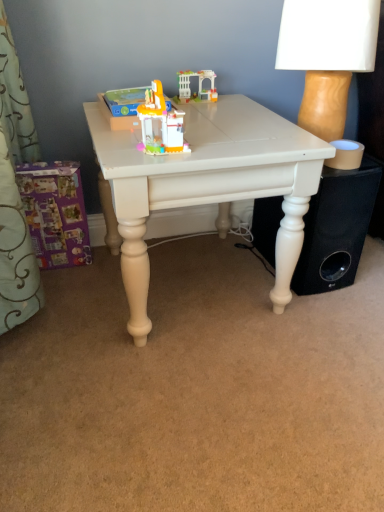
Question: Is black matte speaker at lower right closer to the viewer compared to purple cardboard box at lower left, the 1th toy positioned from the bottom?

Choices:
 (A) yes
 (B) no

Answer: (A)

Question: Would you consider black matte speaker at lower right to be distant from purple cardboard box at lower left, acting as the 2th toy starting from the back?

Choices:
 (A) yes
 (B) no

Answer: (B)

Question: Can you confirm if black matte speaker at lower right is positioned to the right of purple cardboard box at lower left, arranged as the first toy when viewed from the left?

Choices:
 (A) yes
 (B) no

Answer: (A)

Question: Considering the relative sizes of black matte speaker at lower right and purple cardboard box at lower left, acting as the 2th toy starting from the back, in the image provided, is black matte speaker at lower right thinner than purple cardboard box at lower left, acting as the 2th toy starting from the back,?

Choices:
 (A) no
 (B) yes

Answer: (A)

Question: Are black matte speaker at lower right and purple cardboard box at lower left, acting as the 2th toy starting from the back, making contact?

Choices:
 (A) no
 (B) yes

Answer: (A)

Question: Considering the relative sizes of black matte speaker at lower right and purple cardboard box at lower left, the 1th toy positioned from the bottom, in the image provided, is black matte speaker at lower right smaller than purple cardboard box at lower left, the 1th toy positioned from the bottom,?

Choices:
 (A) yes
 (B) no

Answer: (B)

Question: Considering the relative positions of white painted wood table at center and white plastic arch at center, positioned as the 1th toy in right-to-left order, in the image provided, is white painted wood table at center to the right of white plastic arch at center, positioned as the 1th toy in right-to-left order, from the viewer's perspective?

Choices:
 (A) no
 (B) yes

Answer: (A)

Question: Is white painted wood table at center next to white plastic arch at center, positioned as the 4th toy in front-to-back order?

Choices:
 (A) yes
 (B) no

Answer: (B)

Question: Considering the relative sizes of white painted wood table at center and white plastic arch at center, acting as the first toy starting from the top, in the image provided, is white painted wood table at center taller than white plastic arch at center, acting as the first toy starting from the top,?

Choices:
 (A) no
 (B) yes

Answer: (B)

Question: Is white painted wood table at center positioned far away from white plastic arch at center, the fourth toy in the bottom-to-top sequence?

Choices:
 (A) no
 (B) yes

Answer: (A)

Question: From a real-world perspective, is white painted wood table at center under white plastic arch at center, the fourth toy in the bottom-to-top sequence?

Choices:
 (A) yes
 (B) no

Answer: (A)

Question: Considering the relative positions of white painted wood table at center and white plastic arch at center, positioned as the 1th toy in right-to-left order, in the image provided, is white painted wood table at center in front of white plastic arch at center, positioned as the 1th toy in right-to-left order,?

Choices:
 (A) yes
 (B) no

Answer: (A)

Question: Is purple cardboard box at lower left, marked as the fourth toy in a right-to-left arrangement, wider than black matte speaker at lower right?

Choices:
 (A) yes
 (B) no

Answer: (B)